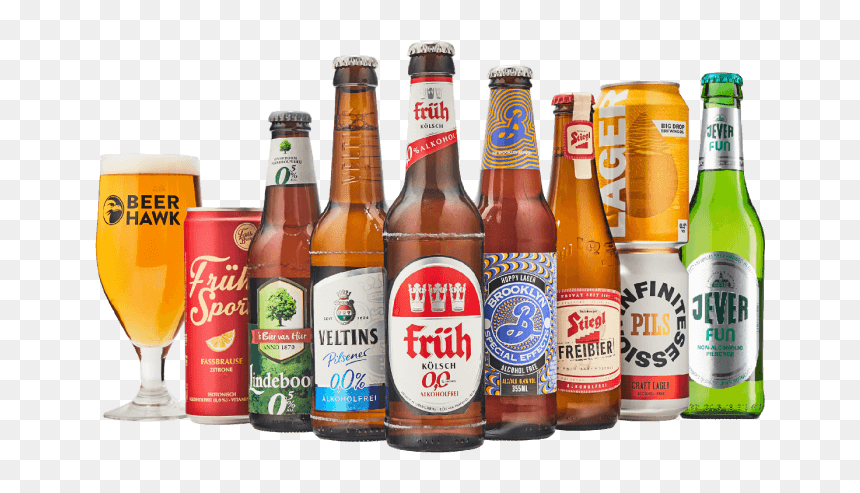
Image resolution: width=860 pixels, height=493 pixels. In order to click on alcohol (beer) in vessles in this screenshot , I will do `click(139, 262)`, `click(220, 309)`, `click(286, 309)`, `click(360, 301)`, `click(428, 298)`, `click(538, 277)`, `click(581, 277)`, `click(637, 289)`, `click(630, 176)`, `click(721, 307)`.